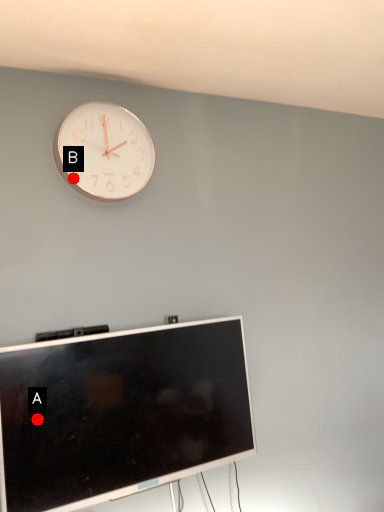
Question: Two points are circled on the image, labeled by A and B beside each circle. Which point is closer to the camera?

Choices:
 (A) A is closer
 (B) B is closer

Answer: (A)